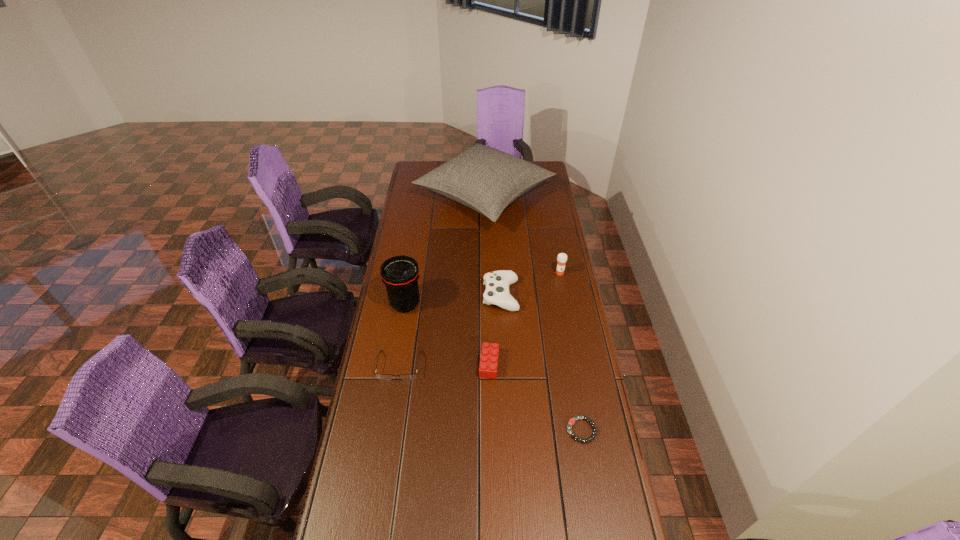
At what (x,y) coordinates should I click in order to perform the action: click on cushion present at the right edge. Please return your answer as a coordinate pair (x, y). Looking at the image, I should click on (487, 180).

Locate an element on the screen. medicine situated at the right edge is located at coordinates (562, 257).

Image resolution: width=960 pixels, height=540 pixels. Identify the location of bracelet at the right edge. (571, 422).

I want to click on object that is at the far left corner, so click(487, 180).

Identify the location of object that is at the far right corner. This screenshot has width=960, height=540. (487, 180).

Find the location of a particular element. vacant region at the left edge of the desktop is located at coordinates click(394, 435).

You are a GUI agent. You are given a task and a screenshot of the screen. Output one action in this format:
    pyautogui.click(x=<x>, y=<y>)
    Task: Click on the vacant space at the right edge of the desktop
    The width and height of the screenshot is (960, 540).
    Given the screenshot: What is the action you would take?
    pyautogui.click(x=607, y=456)

Where is `vacant area that lies between the sixth tallest object and the cushion`? vacant area that lies between the sixth tallest object and the cushion is located at coordinates (442, 281).

Identify the location of vacant area that lies between the sixth nearest object and the farthest object. (522, 235).

Locate an element on the screen. free spot between the cushion and the fourth tallest object is located at coordinates (492, 246).